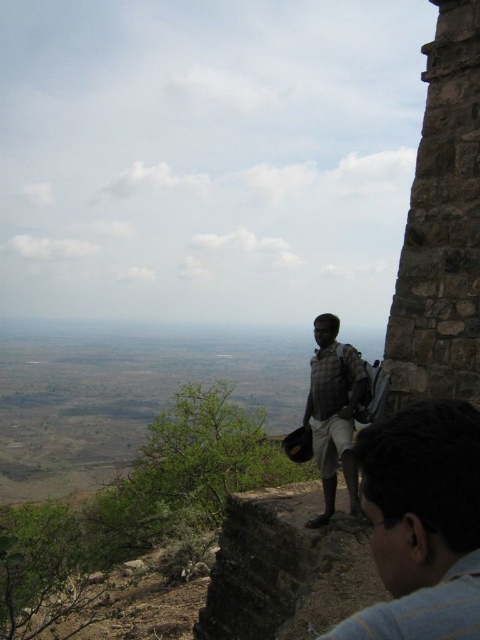
Question: Can you confirm if blue denim shirt at lower right is wider than checkered fabric shirt at center?

Choices:
 (A) no
 (B) yes

Answer: (A)

Question: Observing the image, what is the correct spatial positioning of blue denim shirt at lower right in reference to checkered fabric shirt at center?

Choices:
 (A) below
 (B) above

Answer: (A)

Question: Which object appears farthest from the camera in this image?

Choices:
 (A) blue denim shirt at lower right
 (B) checkered fabric shirt at center

Answer: (B)

Question: Among these points, which one is nearest to the camera?

Choices:
 (A) (384, 506)
 (B) (336, 364)

Answer: (A)

Question: Does blue denim shirt at lower right have a greater width compared to checkered fabric shirt at center?

Choices:
 (A) yes
 (B) no

Answer: (B)

Question: Which object appears farthest from the camera in this image?

Choices:
 (A) blue denim shirt at lower right
 (B) checkered fabric shirt at center

Answer: (B)